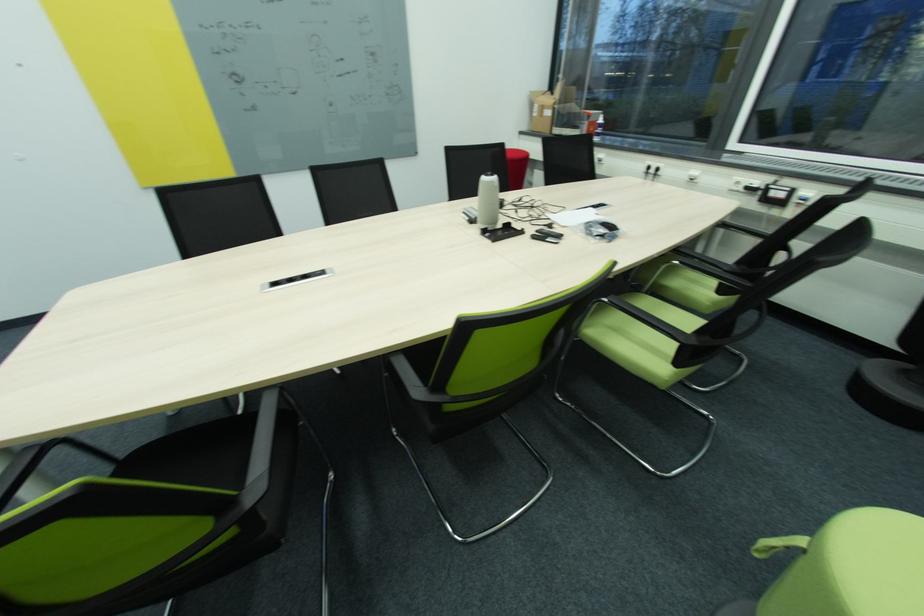
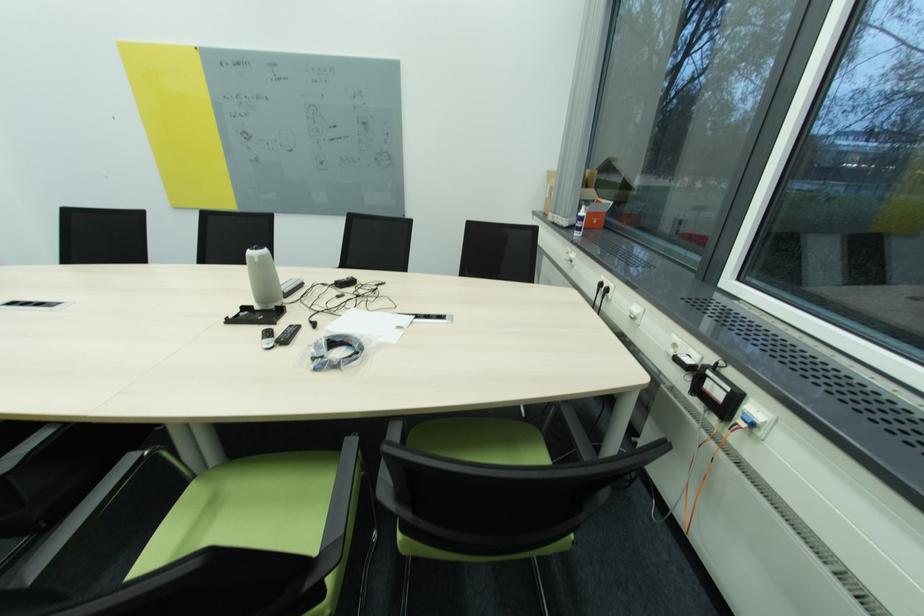
In the second image, find the point that corresponds to point (695, 177) in the first image.

(636, 314)